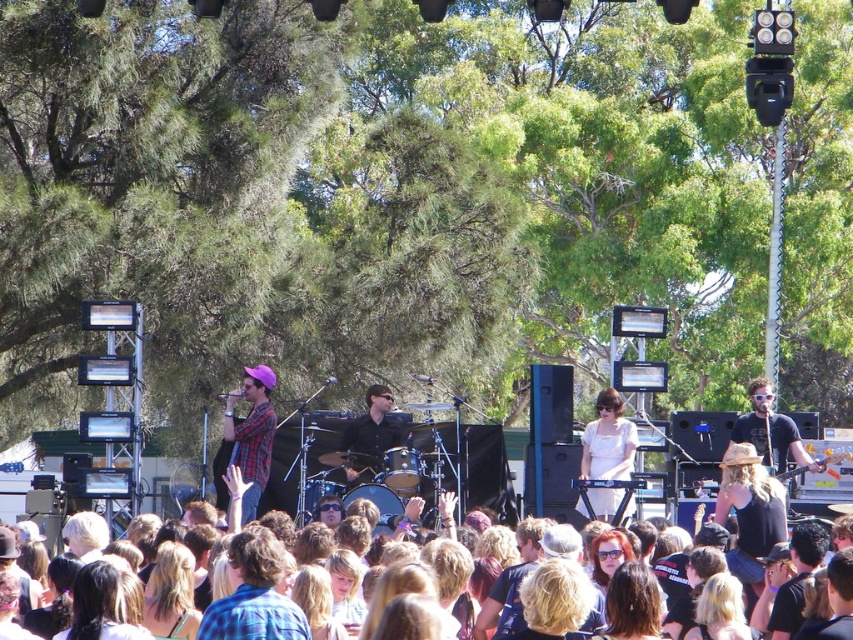
You are a photographer at the concert and want to capture the white matte dress at center in your shot. Based on its position, where should you aim your camera?

The white matte dress at center is located at the 2D coordinates point (608,440), so aim your camera towards that position to capture it.

You are a photographer at the concert and want to capture both the plaid fabric shirt at center and the black matte shirt at center in a single shot. What is the minimum distance you need to move back from your current position to ensure both shirts are in frame?

The plaid fabric shirt at center and black matte shirt at center are 3.08 meters apart. To capture both in a single shot, you need to move back at least 3.08 meters to ensure the camera can encompass the entire distance between them.